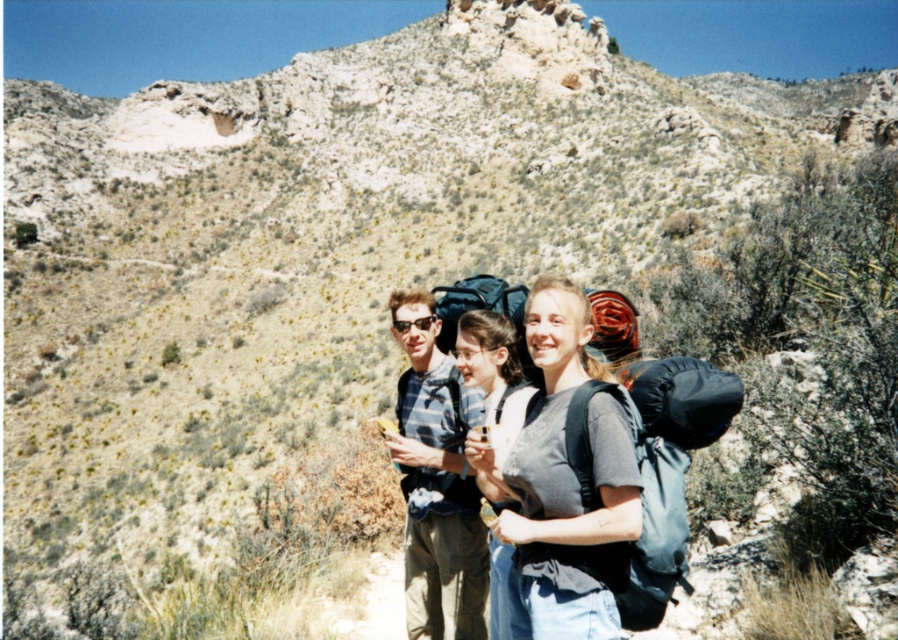
Is the position of gray fabric backpack at center more distant than that of blue plaid shirt at center?

No, gray fabric backpack at center is in front of blue plaid shirt at center.

Is gray fabric backpack at center below blue plaid shirt at center?

No.

Is point (540, 499) positioned before point (436, 330)?

Yes, it is.

The image size is (898, 640). I want to click on gray fabric backpack at center, so click(565, 484).

Who is positioned more to the right, gray fabric backpack at center or matte gray backpack at center?

gray fabric backpack at center

Does gray fabric backpack at center have a greater height compared to matte gray backpack at center?

Yes, gray fabric backpack at center is taller than matte gray backpack at center.

Is point (541, 609) closer to viewer compared to point (500, 408)?

Yes.

Find the location of `gray fabric backpack at center`. gray fabric backpack at center is located at coordinates (565, 484).

Looking at this image, is blue plaid shirt at center positioned at the back of matte gray backpack at center?

That is True.

This screenshot has width=898, height=640. Identify the location of blue plaid shirt at center. (436, 481).

Who is more distant from viewer, (443, 620) or (499, 406)?

The point (499, 406) is behind.

Image resolution: width=898 pixels, height=640 pixels. I want to click on blue plaid shirt at center, so click(436, 481).